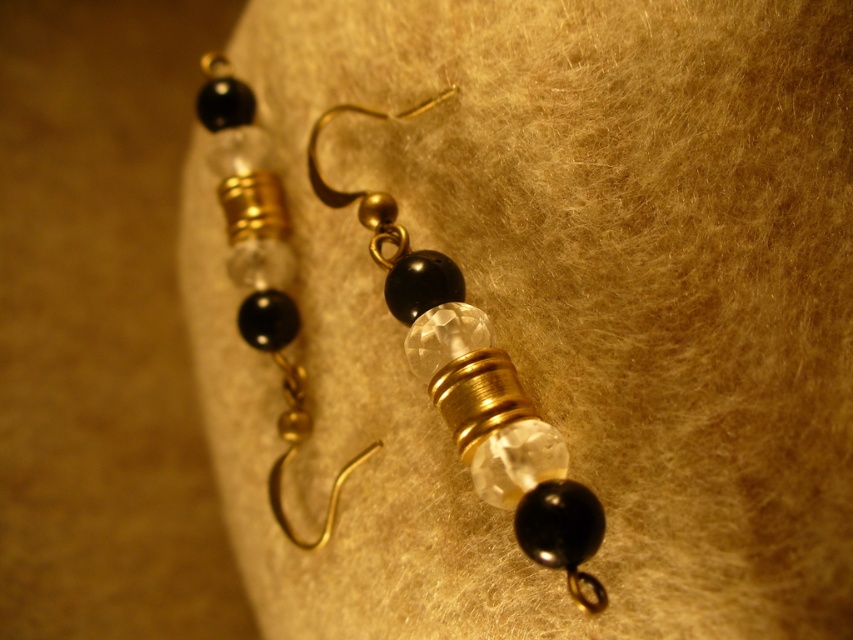
Question: Is matte gold hook at center closer to the viewer compared to clear crystal bead at center?

Choices:
 (A) yes
 (B) no

Answer: (A)

Question: Does matte gold hook at center have a larger size compared to clear crystal bead at center?

Choices:
 (A) yes
 (B) no

Answer: (A)

Question: From the image, what is the correct spatial relationship of matte gold hook at center in relation to clear crystal bead at center?

Choices:
 (A) left
 (B) right

Answer: (B)

Question: Which point appears farthest from the camera in this image?

Choices:
 (A) (343, 196)
 (B) (213, 83)

Answer: (B)

Question: Which point is closer to the camera?

Choices:
 (A) (444, 340)
 (B) (256, 161)

Answer: (A)